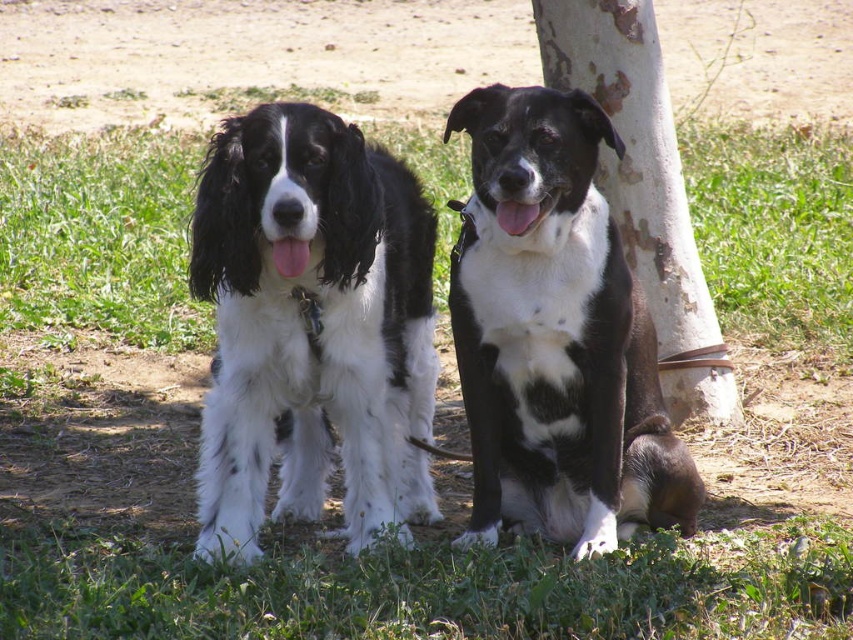
Question: Estimate the real-world distances between objects in this image. Which object is farther from the soft white fur at center?

Choices:
 (A) green grass at lower center
 (B) black/white fur dog at center

Answer: (A)

Question: Does soft white fur at center have a lesser width compared to white rough bark at center?

Choices:
 (A) yes
 (B) no

Answer: (A)

Question: Can you confirm if soft white fur at center is positioned below green grass at lower center?

Choices:
 (A) yes
 (B) no

Answer: (B)

Question: Estimate the real-world distances between objects in this image. Which object is closer to the green grass at lower center?

Choices:
 (A) black/white fur dog at center
 (B) soft white fur at center
 (C) white rough bark at center

Answer: (B)

Question: Among these objects, which one is nearest to the camera?

Choices:
 (A) soft white fur at center
 (B) black/white fur dog at center
 (C) white rough bark at center

Answer: (B)

Question: Is soft white fur at center in front of black/white fur dog at center?

Choices:
 (A) no
 (B) yes

Answer: (A)